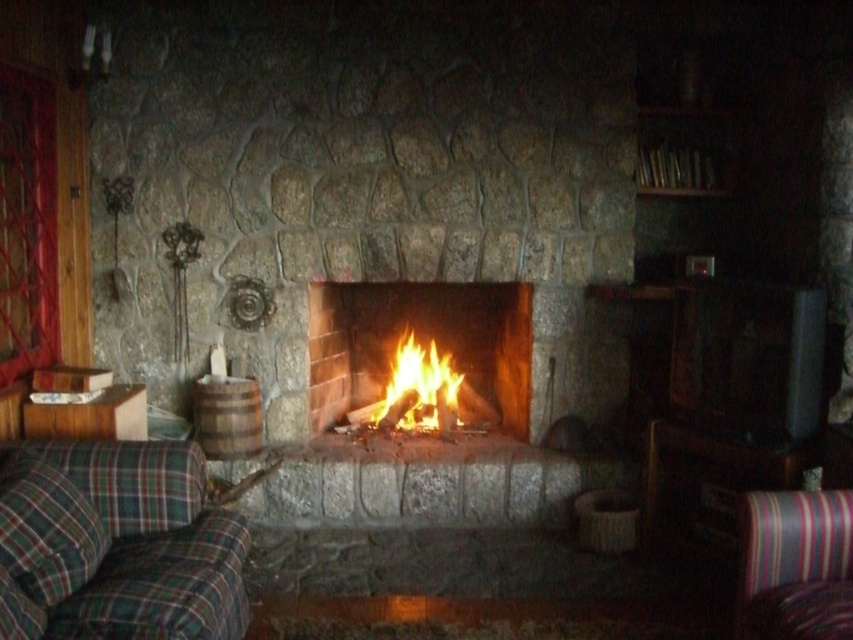
You are sitting in the striped fabric armchair at lower right and want to reach the flaming wood at center to add more logs. Can you comfortably reach it from your current position?

The striped fabric armchair at lower right is shorter than the flaming wood at center, so you might have difficulty comfortably reaching the flames from your seated position.

You are standing in the room and want to place a small potted plant between the two points marked as point [318,333] and point [773,608]. Based on their positions, which point should the plant be closer to in order to be in front of the fireplace?

The plant should be closer to point [773,608] because point [318,333] is behind point [773,608], so placing it near the front point ensures it is in front of the fireplace.

You are planning to place a new coffee table between the striped fabric armchair at lower right and the flaming wood at center. Given that the coffee table is 1.2 meters wide, will it fit comfortably without overlapping either object?

The striped fabric armchair at lower right has a lesser width compared to flaming wood at center. Since the coffee table is 1.2 meters wide, it depends on the actual distance between them. However, the description only mentions their widths, not the space between. Without knowing the distance between the two objects, we cannot determine if the coffee table will fit comfortably.